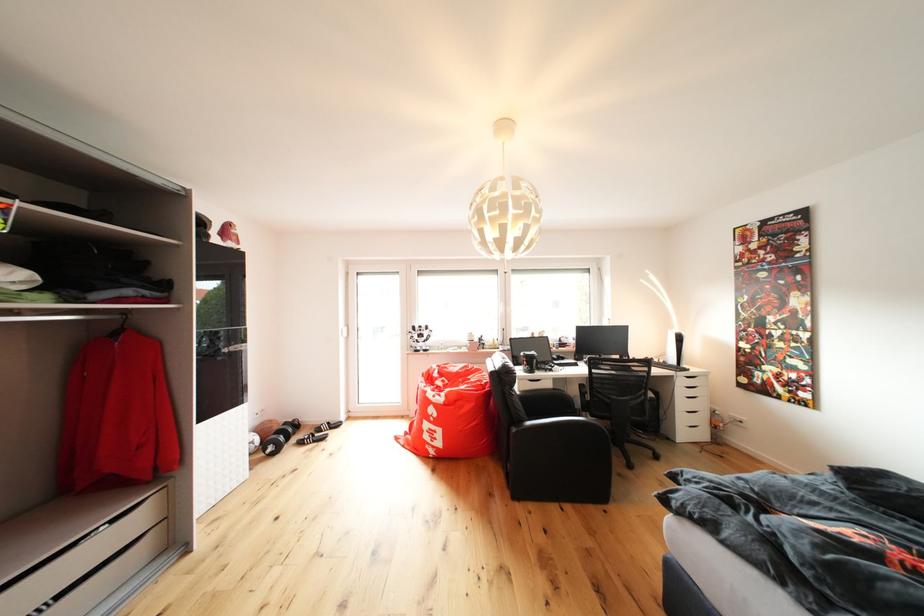
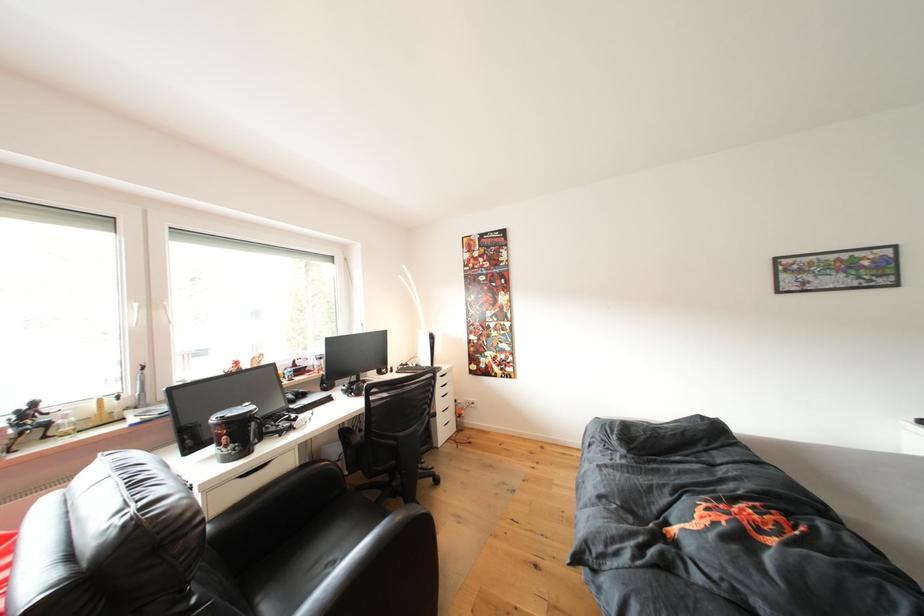
Find the pixel in the second image that matches the point at 541,369 in the first image.

(253, 440)